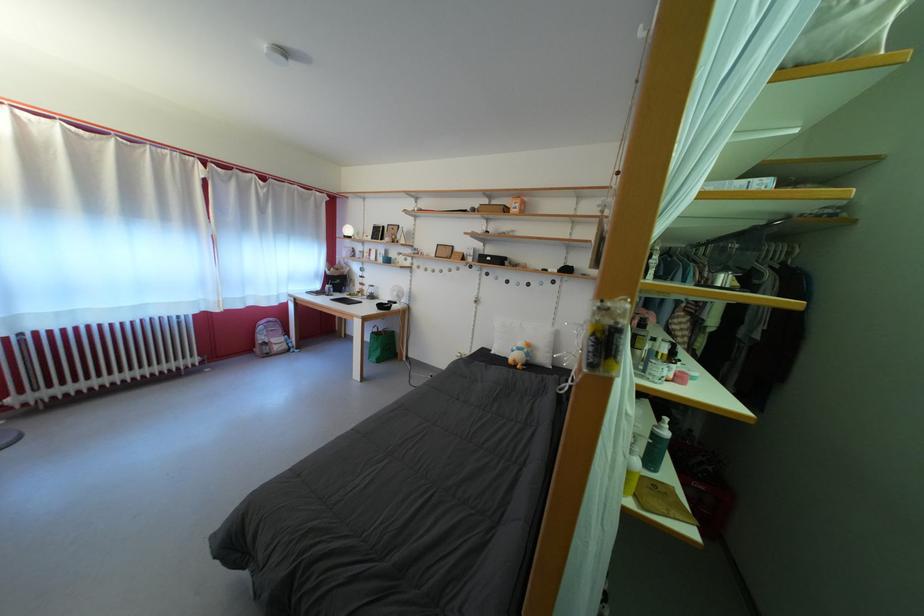
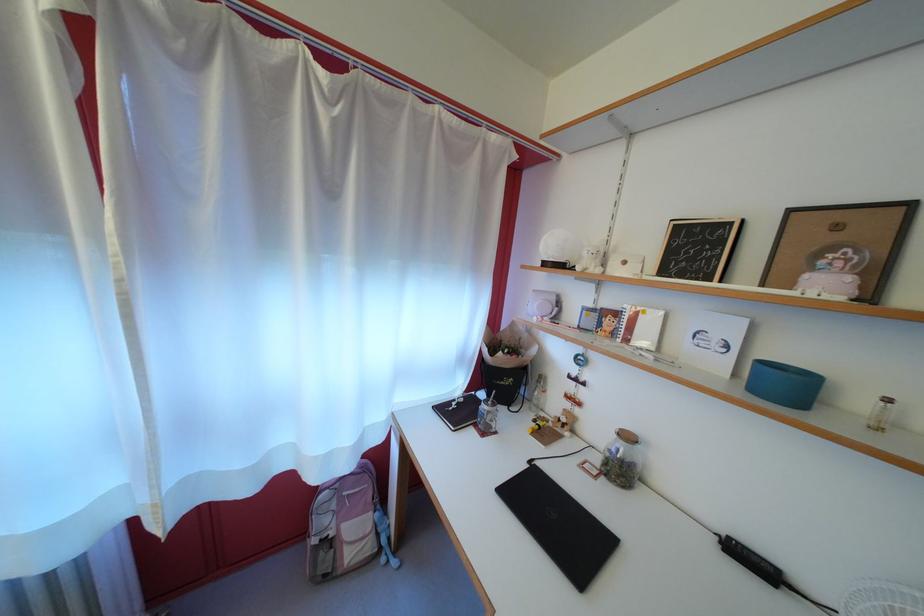
What movement of the cameraman would produce the second image?

The cameraman walked toward left, forward.